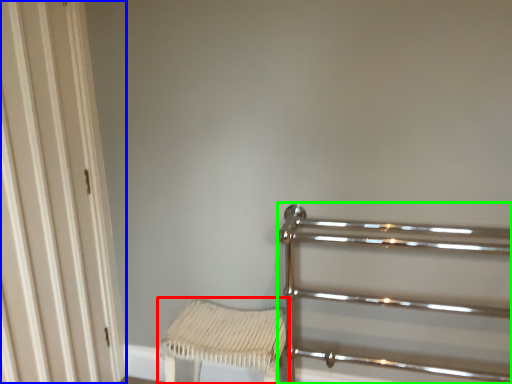
Question: Which object is the closest to the furniture (highlighted by a red box)? Choose among these: door (highlighted by a blue box) or rail (highlighted by a green box).

Choices:
 (A) door
 (B) rail

Answer: (B)